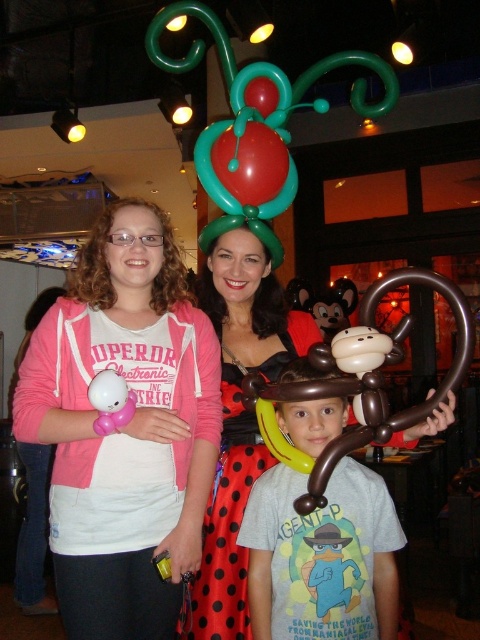
Question: Considering the relative positions of pink fleece jacket at upper left and brown rubber balloon monkey at center in the image provided, where is pink fleece jacket at upper left located with respect to brown rubber balloon monkey at center?

Choices:
 (A) below
 (B) above

Answer: (B)

Question: Which point is closer to the camera taking this photo?

Choices:
 (A) (x=106, y=412)
 (B) (x=178, y=634)
 (C) (x=252, y=122)
 (D) (x=300, y=544)

Answer: (A)

Question: Is red polka dot dress at center below shiny red balloon at center?

Choices:
 (A) yes
 (B) no

Answer: (A)

Question: Which object is closer to the camera taking this photo?

Choices:
 (A) red polka dot dress at center
 (B) matte black balloon hat at center
 (C) shiny red balloon at center

Answer: (A)

Question: Is shiny red balloon at center behind white matte balloon at lower left?

Choices:
 (A) yes
 (B) no

Answer: (A)

Question: Which of the following is the closest to the observer?

Choices:
 (A) matte black balloon hat at center
 (B) pink fleece jacket at upper left

Answer: (B)